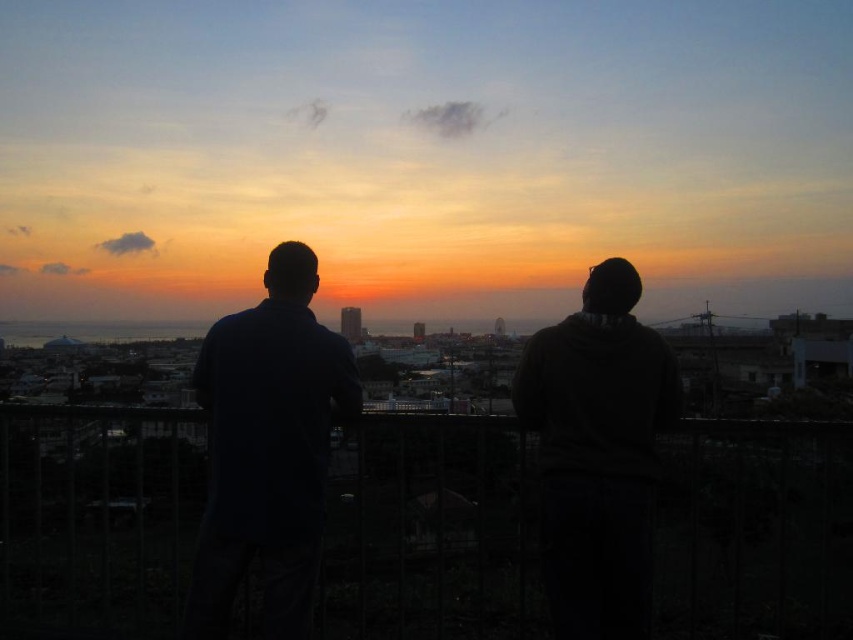
Is silhouette clothing at center further to the viewer compared to dark gray hoodie at center?

No.

Which is in front, point (206, 628) or point (584, 589)?

Positioned in front is point (206, 628).

This screenshot has width=853, height=640. In order to click on silhouette clothing at center in this screenshot , I will do `click(267, 448)`.

Is silhouette clothing at center bigger than dark blue shirt at left?

Yes, silhouette clothing at center is bigger than dark blue shirt at left.

Identify the location of silhouette clothing at center. The height and width of the screenshot is (640, 853). (267, 448).

Is dark blue shirt at left positioned in front of dark gray hoodie at center?

Yes, it is in front of dark gray hoodie at center.

Is dark blue shirt at left further to camera compared to dark gray hoodie at center?

No.

Which is behind, point (321, 384) or point (573, 348)?

Point (573, 348)

At what (x,y) coordinates should I click in order to perform the action: click on dark blue shirt at left. Please return your answer as a coordinate pair (x, y). This screenshot has width=853, height=640. Looking at the image, I should click on (267, 448).